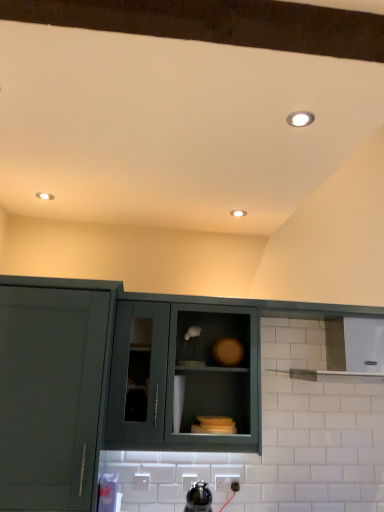
Question: Could you tell me if matte white recessed light at center is turned towards white glossy light fixture at upper right?

Choices:
 (A) yes
 (B) no

Answer: (B)

Question: From the image's perspective, does matte white recessed light at center appear higher than white glossy light fixture at upper right?

Choices:
 (A) no
 (B) yes

Answer: (A)

Question: Would you consider matte white recessed light at center to be distant from white glossy light fixture at upper right?

Choices:
 (A) no
 (B) yes

Answer: (A)

Question: Does matte white recessed light at center have a greater height compared to white glossy light fixture at upper right?

Choices:
 (A) yes
 (B) no

Answer: (A)

Question: Is matte white recessed light at center smaller than white glossy light fixture at upper right?

Choices:
 (A) no
 (B) yes

Answer: (A)

Question: Is matte white recessed light at center bigger than white glossy light fixture at upper right?

Choices:
 (A) no
 (B) yes

Answer: (B)

Question: Can you confirm if matte green cabinet at center, arranged as the 3th cabinetry when viewed from the left, is wider than matte white recessed light at center?

Choices:
 (A) no
 (B) yes

Answer: (A)

Question: Does matte green cabinet at center, the 1th cabinetry in the right-to-left sequence, have a lesser height compared to matte white recessed light at center?

Choices:
 (A) no
 (B) yes

Answer: (A)

Question: Is matte green cabinet at center, the 1th cabinetry in the right-to-left sequence, placed right next to matte white recessed light at center?

Choices:
 (A) no
 (B) yes

Answer: (A)

Question: Is matte green cabinet at center, arranged as the 3th cabinetry when viewed from the left, at the left side of matte white recessed light at center?

Choices:
 (A) no
 (B) yes

Answer: (A)

Question: Is matte green cabinet at center, arranged as the 3th cabinetry when viewed from the left, outside matte white recessed light at center?

Choices:
 (A) no
 (B) yes

Answer: (B)

Question: Is matte green cabinet at center, the second cabinetry in the left-to-right sequence, positioned with its back to matte green cabinet at center, arranged as the 3th cabinetry when viewed from the left?

Choices:
 (A) yes
 (B) no

Answer: (A)